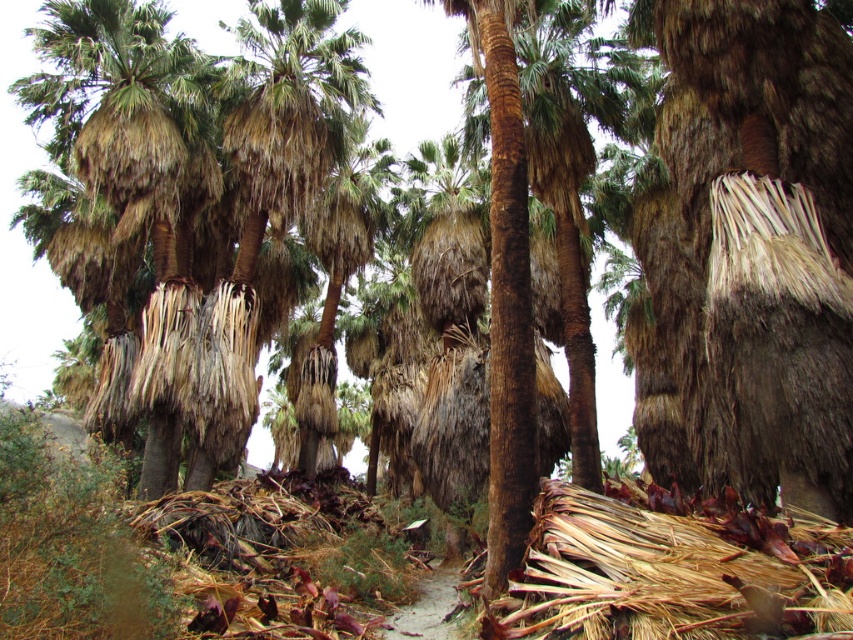
Is brown textured palm tree at lower left taller than brown dirt path at center?

Correct, brown textured palm tree at lower left is much taller as brown dirt path at center.

Is point (108, 38) closer to viewer compared to point (451, 621)?

No, (108, 38) is behind (451, 621).

Identify the location of brown textured palm tree at lower left. (135, 184).